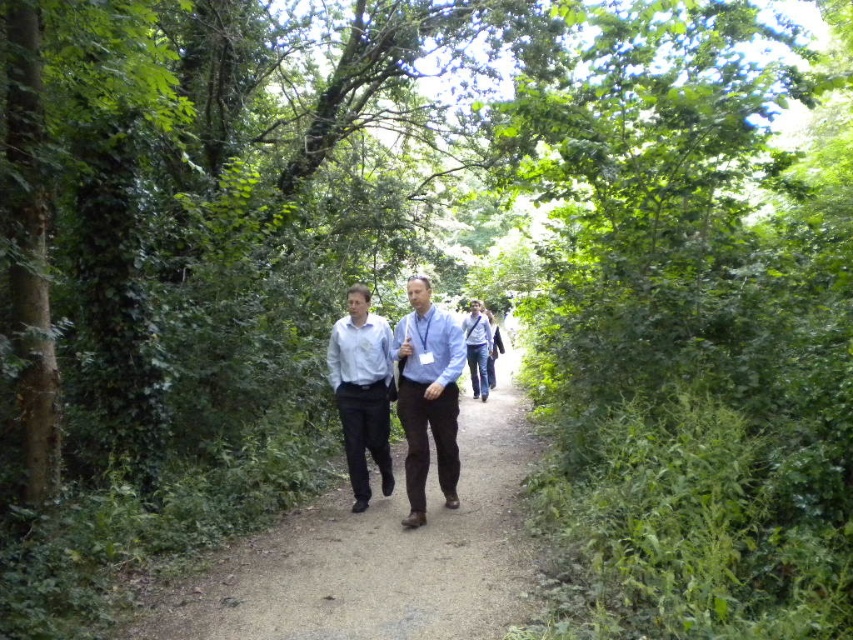
Question: Can you confirm if blue shirt at center is positioned below matte blue shirt at center?

Choices:
 (A) yes
 (B) no

Answer: (B)

Question: Among these objects, which one is farthest from the camera?

Choices:
 (A) matte blue shirt at center
 (B) blue shirt at center
 (C) smooth dirt path at center

Answer: (A)

Question: Based on their relative distances, which object is farther from the smooth dirt path at center?

Choices:
 (A) blue shirt at center
 (B) matte blue shirt at center

Answer: (B)

Question: Does smooth dirt path at center appear under blue shirt at center?

Choices:
 (A) no
 (B) yes

Answer: (B)

Question: Which point is closer to the camera taking this photo?

Choices:
 (A) (448, 349)
 (B) (376, 440)

Answer: (A)

Question: Does smooth dirt path at center appear on the right side of matte blue shirt at center?

Choices:
 (A) no
 (B) yes

Answer: (B)